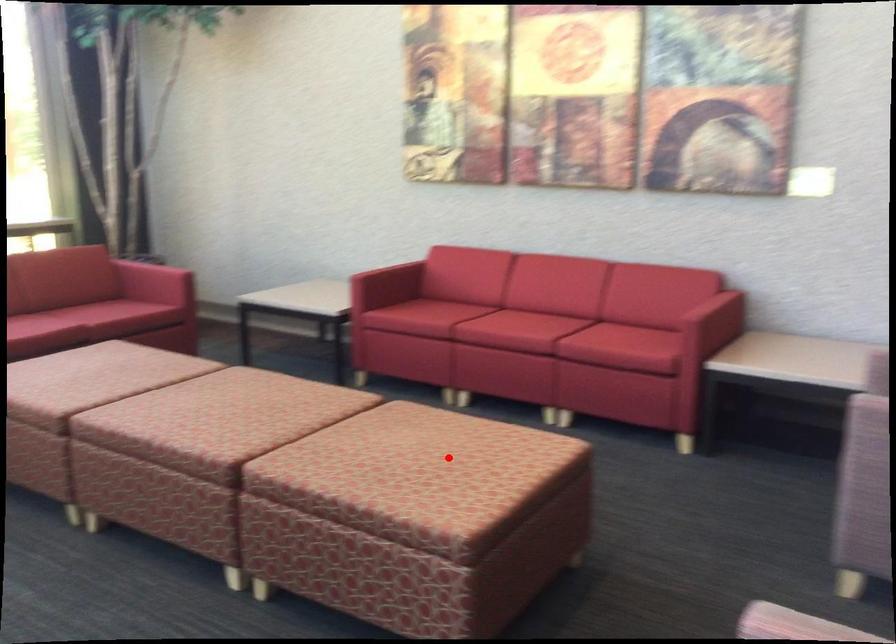
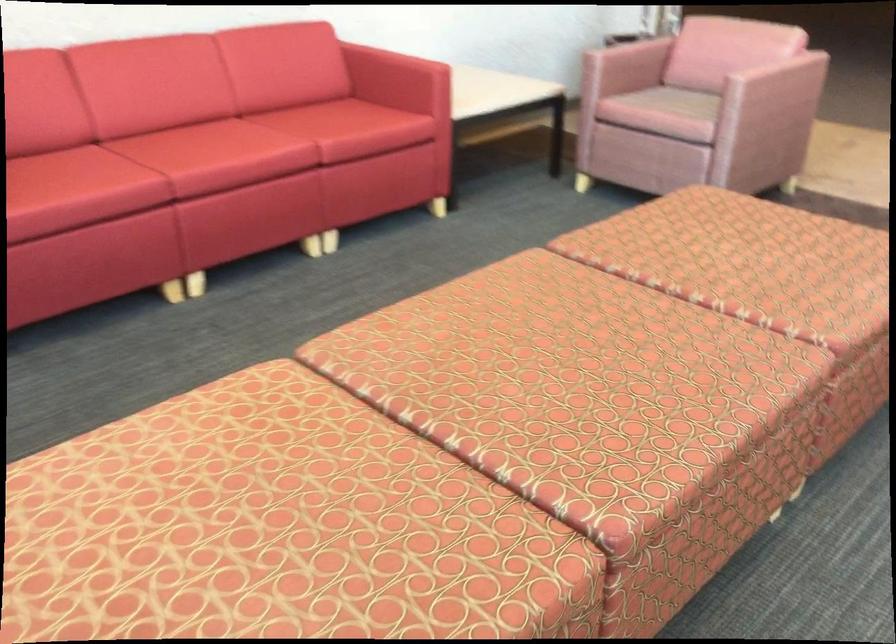
Question: A red point is marked in image1. In image2, is the corresponding 3D point closer to the camera or farther? Reply with the corresponding letter.

Choices:
 (A) The corresponding 3D point is closer.
 (B) The corresponding 3D point is farther.

Answer: (A)